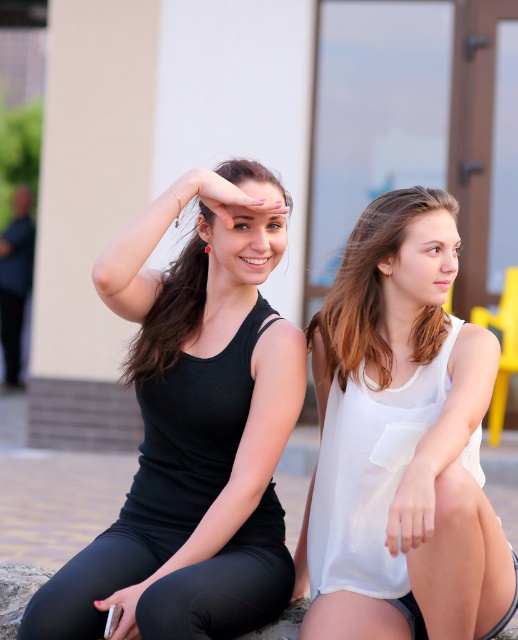
Between matte black tank top at left and white matte hand at lower right, which one has more height?

matte black tank top at left

Does matte black tank top at left have a larger size compared to white matte hand at lower right?

Yes.

Is point (185, 259) farther from camera compared to point (397, 500)?

Yes, it is.

Where is `matte black tank top at left`? matte black tank top at left is located at coordinates (172, 308).

You are a GUI agent. You are given a task and a screenshot of the screen. Output one action in this format:
    pyautogui.click(x=<x>, y=<y>)
    Task: Click on the black matte tank top at left
    This screenshot has width=518, height=640.
    Given the screenshot: What is the action you would take?
    pyautogui.click(x=194, y=428)

Can you confirm if black matte tank top at left is positioned below white matte hand at lower right?

No, black matte tank top at left is not below white matte hand at lower right.

Locate an element on the screen. This screenshot has height=640, width=518. black matte tank top at left is located at coordinates (194, 428).

Is point (510, 595) positioned behind point (400, 513)?

Yes, it is behind point (400, 513).

The width and height of the screenshot is (518, 640). Identify the location of white matte tank top at right. (440, 531).